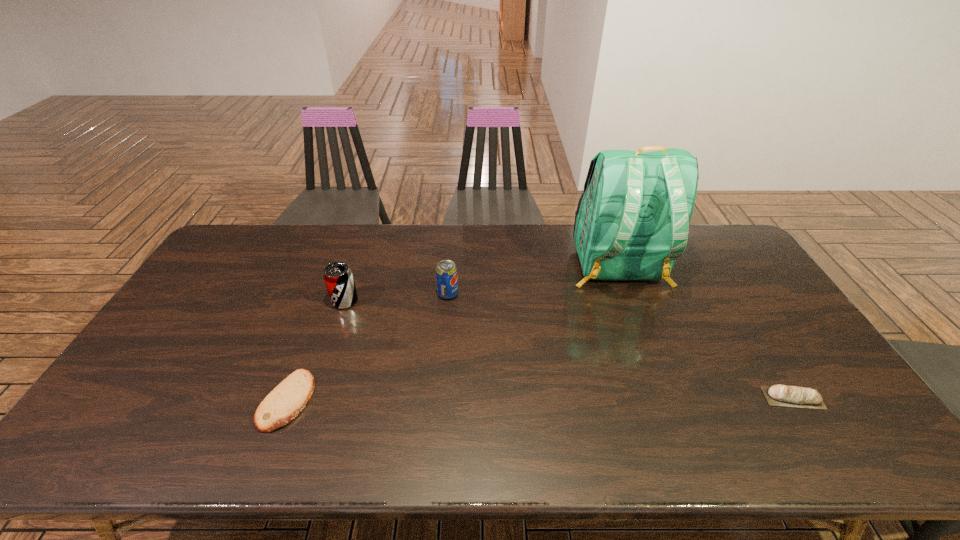
Find the location of `object that stands as the closest to the third object from left to right`. object that stands as the closest to the third object from left to right is located at coordinates (338, 277).

Identify the location of object that can be found as the third closest to the left pita bread. Image resolution: width=960 pixels, height=540 pixels. (632, 222).

Identify the location of vacant space that satisfies the following two spatial constraints: 1. on the front side of the left soda; 2. on the left side of the right pita bread. The height and width of the screenshot is (540, 960). (313, 397).